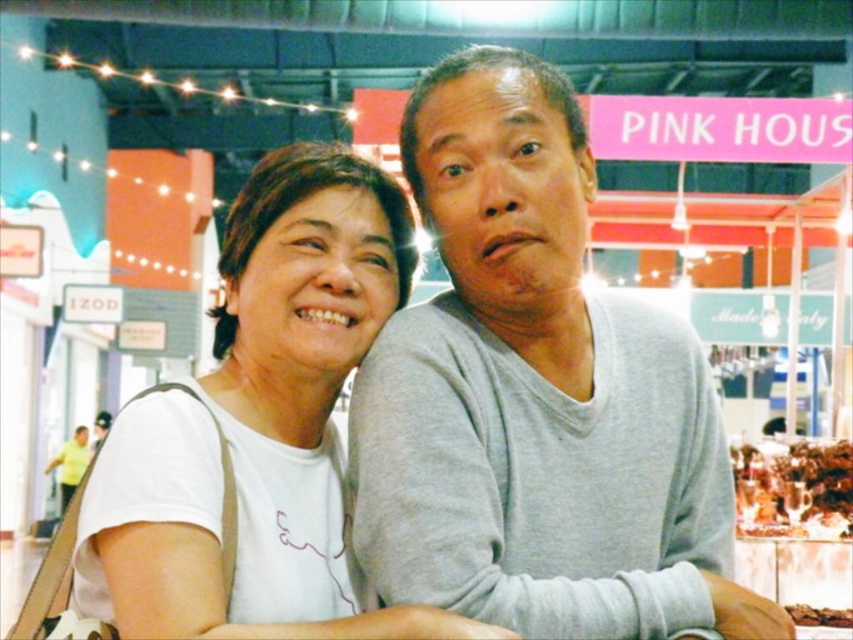
Can you confirm if gray matte sweater at center is positioned below brown crumbly bread at center?

Incorrect, gray matte sweater at center is not positioned below brown crumbly bread at center.

In the scene shown: How far apart are gray matte sweater at center and brown crumbly bread at center?

The distance of gray matte sweater at center from brown crumbly bread at center is 4.55 meters.

Is point (606, 524) positioned behind point (828, 611)?

No, it is in front of (828, 611).

The width and height of the screenshot is (853, 640). I want to click on gray matte sweater at center, so coord(537,396).

Locate an element on the screen. The image size is (853, 640). white cotton t-shirt at center is located at coordinates (262, 422).

Can you confirm if white cotton t-shirt at center is wider than brown matte food at center?

Correct, the width of white cotton t-shirt at center exceeds that of brown matte food at center.

Locate an element on the screen. white cotton t-shirt at center is located at coordinates (262, 422).

Which is behind, point (268, 182) or point (790, 605)?

Positioned behind is point (790, 605).

Can you confirm if white cotton t-shirt at center is thinner than brown crumbly bread at center?

In fact, white cotton t-shirt at center might be wider than brown crumbly bread at center.

Identify the location of white cotton t-shirt at center. (262, 422).

Identify the location of white cotton t-shirt at center. (262, 422).